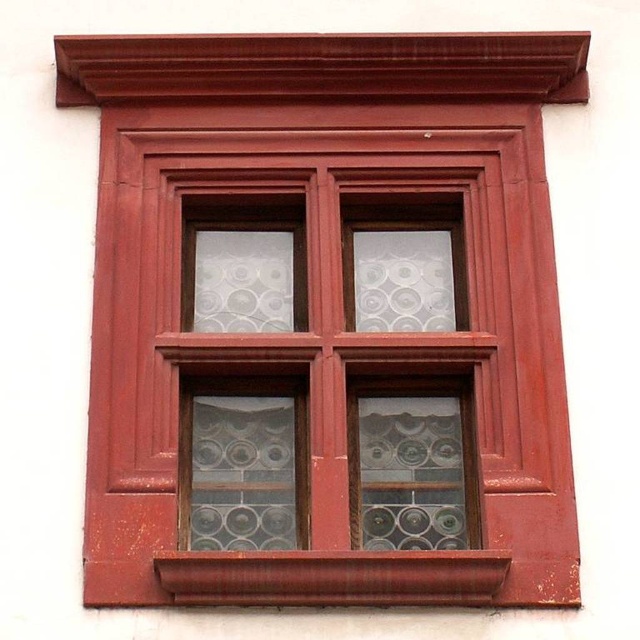
You are standing in front of the window and want to place a small plant on the closest part of the structure to you. Which part should you choose between the stained glass window at center and the smooth wood window sill at bottom?

The stained glass window at center is closer to you than the smooth wood window sill at bottom, so you should place the plant on the stained glass window at center.

You are a painter who wants to place a small vase on the smooth wood window sill at bottom. You need to ensure that the vase won not block the view through the stained glass window at center. Can you do that?

The stained glass window at center is above the smooth wood window sill at bottom, so placing the vase on the sill will not block the view through the stained glass window at center.

You are an interior designer planning to hang a new artwork exactly at the center of the wall. The wall has a stained glass window at center. Can you place the artwork directly at the center without overlapping the window?

The stained glass window at center is already located at the center point of the wall, so placing the artwork there would overlap with the window. Choose a different location.